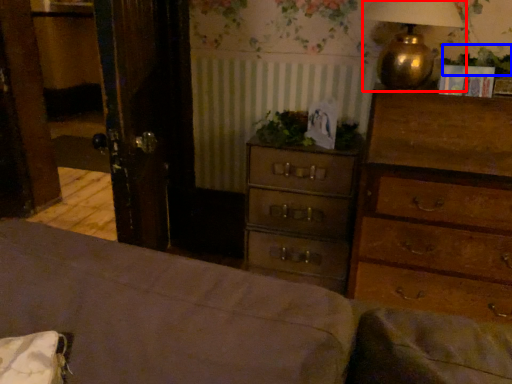
Question: Among these objects, which one is farthest to the camera, table lamp (highlighted by a red box) or plant (highlighted by a blue box)?

Choices:
 (A) table lamp
 (B) plant

Answer: (B)